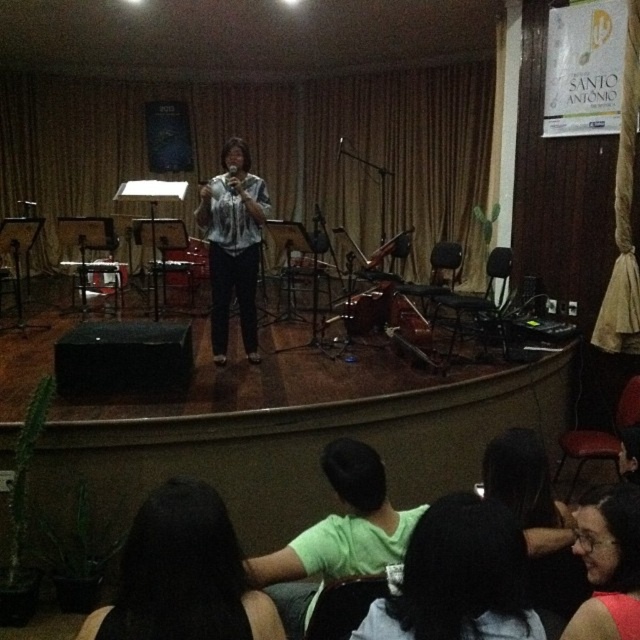
You are a photographer standing at the back of the stage. You want to capture a closeup shot of the black hair at lower center and green matte shirt at lower center. Can you fit both in the frame if your camera has a maximum field of view that can capture 40 centimeters width?

The black hair at lower center and green matte shirt at lower center are 39.29 centimeters apart, so yes, the camera can fit both in the frame since the distance between them is less than the maximum field of view of 40 centimeters.

You are a photographer taking a picture of the stage. You notice the black hair at lower center and the green matte shirt at lower center. Which of these two items is smaller in size?

The black hair at lower center is smaller than the green matte shirt at lower center according to the description.

You are standing in the audience and want to take a photo of the black hair at lower center. If your camera has a minimum focus distance of 4 feet, will you be able to take a clear photo without moving closer?

The black hair at lower center is 3.80 feet away from the viewer, which is within the camera minimum focus distance of 4 feet. Therefore, you can take a clear photo without moving closer.